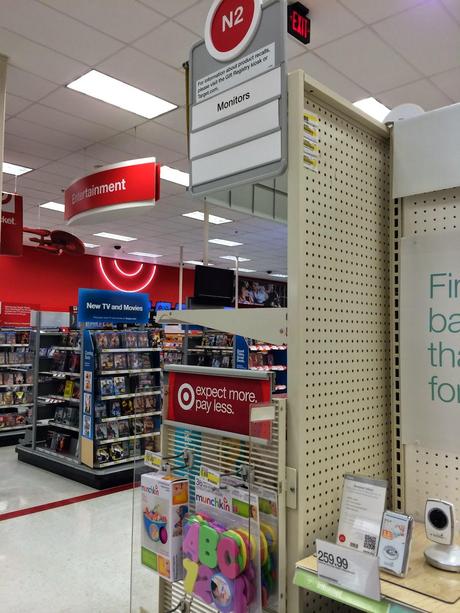
Identify the location of abc and 123's kids toy. The height and width of the screenshot is (613, 460). (208, 539).